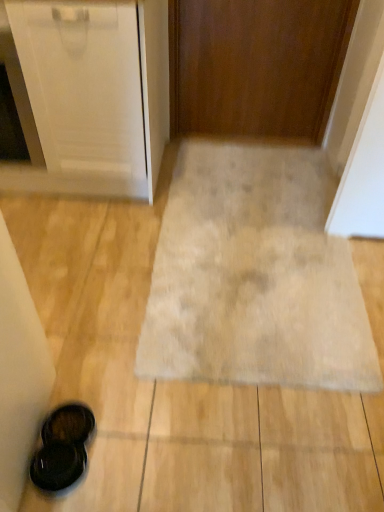
Find the location of a particular element. The height and width of the screenshot is (512, 384). beige carpet at center is located at coordinates (255, 276).

Where is `beige carpet at center`? This screenshot has height=512, width=384. beige carpet at center is located at coordinates (255, 276).

Considering the sizes of objects beige carpet at center and wooden door at center in the image provided, who is shorter, beige carpet at center or wooden door at center?

beige carpet at center.

Does beige carpet at center touch wooden door at center?

No, beige carpet at center is not in contact with wooden door at center.

From the image's perspective, would you say beige carpet at center is positioned over wooden door at center?

No, from the image's perspective, beige carpet at center is not on top of wooden door at center.

Which object is positioned more to the left, beige carpet at center or wooden door at center?

From the viewer's perspective, beige carpet at center appears more on the left side.

Does beige carpet at center have a lesser height compared to black matte sandals at lower left?

Yes, beige carpet at center is shorter than black matte sandals at lower left.

This screenshot has height=512, width=384. In order to click on bath mat beneath the black matte sandals at lower left (from a real-world perspective) in this screenshot , I will do `click(255, 276)`.

From a real-world perspective, is beige carpet at center over black matte sandals at lower left?

No, from a real-world perspective, beige carpet at center is not over black matte sandals at lower left

Is beige carpet at center looking in the opposite direction of black matte sandals at lower left?

No.

Where is `bath mat that appears below the wooden door at center (from the image's perspective)`? This screenshot has height=512, width=384. bath mat that appears below the wooden door at center (from the image's perspective) is located at coordinates (255, 276).

Is wooden door at center turned away from beige carpet at center?

No.

Considering the positions of objects wooden door at center and beige carpet at center in the image provided, who is more to the right, wooden door at center or beige carpet at center?

wooden door at center.

Is point (250, 15) closer or farther from the camera than point (317, 286)?

Point (250, 15).

Between black matte sandals at lower left and beige carpet at center, which one has less height?

beige carpet at center is shorter.

There is a beige carpet at center. Find the location of `footwear above it (from a real-world perspective)`. footwear above it (from a real-world perspective) is located at coordinates (62, 447).

From a real-world perspective, relative to beige carpet at center, is black matte sandals at lower left vertically above or below?

In terms of real-world spatial position, black matte sandals at lower left is above beige carpet at center.

Consider the image. Is black matte sandals at lower left looking in the opposite direction of beige carpet at center?

black matte sandals at lower left is not turned away from beige carpet at center.

In the scene shown: Is wooden door at center facing towards black matte sandals at lower left?

Yes, wooden door at center is oriented towards black matte sandals at lower left.

Can you confirm if wooden door at center is taller than black matte sandals at lower left?

Correct, wooden door at center is much taller as black matte sandals at lower left.

Considering the positions of points (193, 8) and (62, 480), is point (193, 8) closer to camera compared to point (62, 480)?

No, (193, 8) is behind (62, 480).

Considering the relative positions of wooden door at center and black matte sandals at lower left in the image provided, is wooden door at center to the left or to the right of black matte sandals at lower left?

wooden door at center is positioned on black matte sandals at lower left's right side.

Is black matte sandals at lower left inside the boundaries of wooden door at center, or outside?

black matte sandals at lower left cannot be found inside wooden door at center.

Identify the location of door on the right of black matte sandals at lower left. The width and height of the screenshot is (384, 512). [x=256, y=65].

Which is behind, point (60, 413) or point (252, 90)?

The point (252, 90) is farther.

This screenshot has height=512, width=384. Find the location of `bath mat beneath the wooden door at center (from a real-world perspective)`. bath mat beneath the wooden door at center (from a real-world perspective) is located at coordinates (255, 276).

This screenshot has width=384, height=512. I want to click on footwear lying in front of the beige carpet at center, so click(62, 447).

Based on their spatial positions, is wooden door at center or beige carpet at center closer to black matte sandals at lower left?

Among the two, beige carpet at center is located nearer to black matte sandals at lower left.

Based on their spatial positions, is wooden door at center or black matte sandals at lower left further from beige carpet at center?

Based on the image, wooden door at center appears to be further to beige carpet at center.

When comparing their distances from wooden door at center, does black matte sandals at lower left or beige carpet at center seem further?

black matte sandals at lower left lies further to wooden door at center than the other object.

When comparing their distances from wooden door at center, does beige carpet at center or black matte sandals at lower left seem closer?

beige carpet at center lies closer to wooden door at center than the other object.

Which object lies further to the anchor point black matte sandals at lower left, beige carpet at center or wooden door at center?

wooden door at center is further to black matte sandals at lower left.

Which object lies further to the anchor point beige carpet at center, black matte sandals at lower left or wooden door at center?

wooden door at center.

At what (x,y) coordinates should I click in order to perform the action: click on bath mat that lies between wooden door at center and black matte sandals at lower left from top to bottom. Please return your answer as a coordinate pair (x, y). This screenshot has width=384, height=512. Looking at the image, I should click on (255, 276).